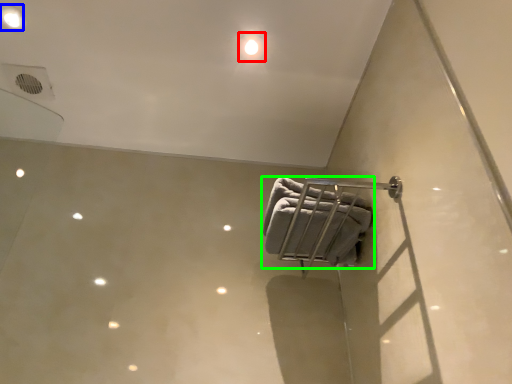
Question: Which object is the farthest from dot (highlighted by a red box)? Choose among these: dot (highlighted by a blue box) or towel (highlighted by a green box).

Choices:
 (A) dot
 (B) towel

Answer: (A)